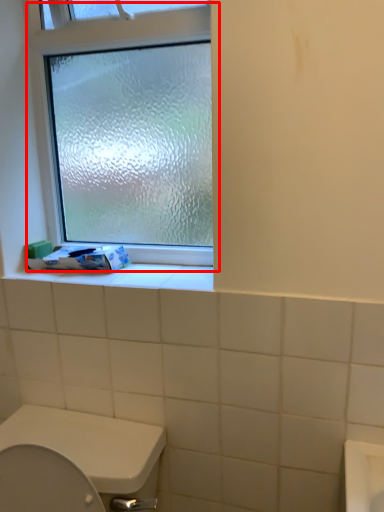
Question: From the image, what is the correct spatial relationship of window (annotated by the red box) in relation to toilet paper?

Choices:
 (A) right
 (B) left

Answer: (A)